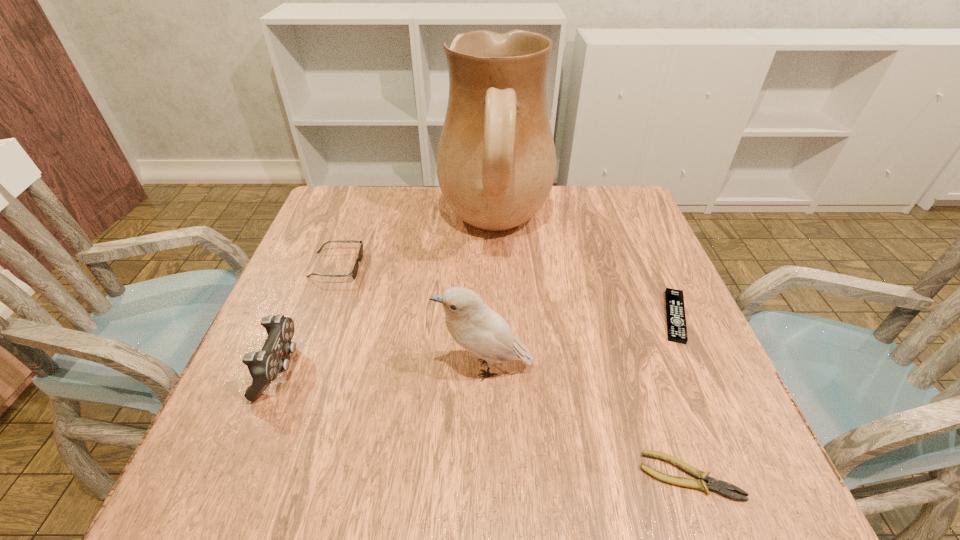
In order to click on free region located at the beak of the second tallest object in this screenshot , I will do `click(255, 368)`.

In order to click on vacant space located 0.330m at the beak of the second tallest object in this screenshot , I will do `click(261, 368)`.

Where is `vacant space located 0.200m on the surface of the fourth shortest object with buttons`? vacant space located 0.200m on the surface of the fourth shortest object with buttons is located at coordinates [x=404, y=368].

At what (x,y) coordinates should I click in order to perform the action: click on free space located on the front-facing side of the sunglasses. Please return your answer as a coordinate pair (x, y). Looking at the image, I should click on (412, 266).

You are a GUI agent. You are given a task and a screenshot of the screen. Output one action in this format:
    pyautogui.click(x=<x>, y=<y>)
    Task: Click on the vacant space located on the left of the remote control
    
    Given the screenshot: What is the action you would take?
    pyautogui.click(x=596, y=316)

This screenshot has height=540, width=960. Identify the location of vacant region located 0.230m on the back of the pliers. (642, 341).

Identify the location of object that is positioned at the far edge. (496, 162).

The height and width of the screenshot is (540, 960). Find the location of `object that is positioned at the near edge`. object that is positioned at the near edge is located at coordinates (712, 484).

The width and height of the screenshot is (960, 540). In order to click on control located at the left edge in this screenshot , I will do `click(264, 366)`.

Locate an element on the screen. sunglasses that is at the left edge is located at coordinates tap(360, 254).